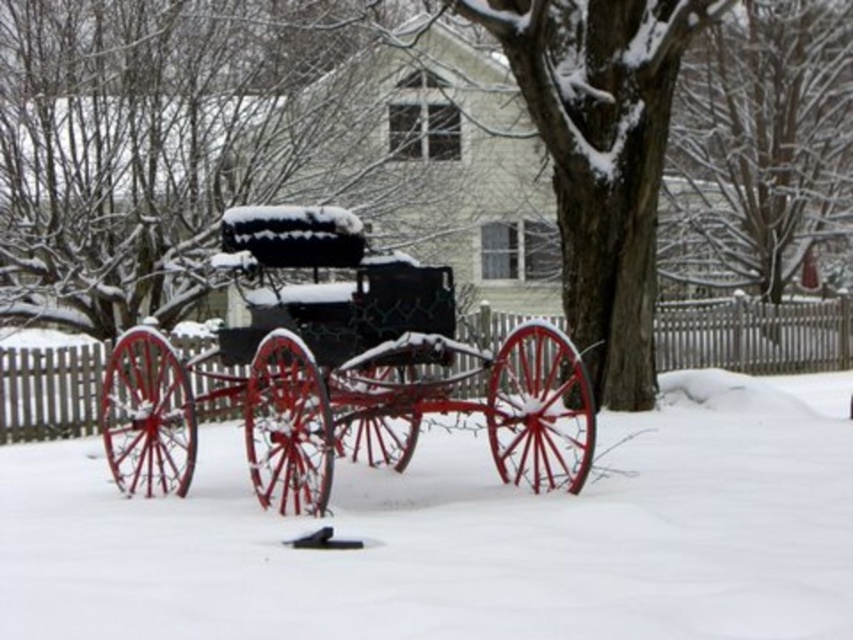
Question: Is white powdery snow at center positioned behind metallic black carriage at center?

Choices:
 (A) yes
 (B) no

Answer: (B)

Question: Observing the image, what is the correct spatial positioning of white powdery snow at center in reference to metallic black carriage at center?

Choices:
 (A) left
 (B) right

Answer: (A)

Question: Which object appears farthest from the camera in this image?

Choices:
 (A) metallic black carriage at center
 (B) white powdery snow at center

Answer: (A)

Question: Among these points, which one is nearest to the camera?

Choices:
 (A) (300, 221)
 (B) (381, 612)

Answer: (B)

Question: Does white powdery snow at center appear on the left side of metallic black carriage at center?

Choices:
 (A) no
 (B) yes

Answer: (B)